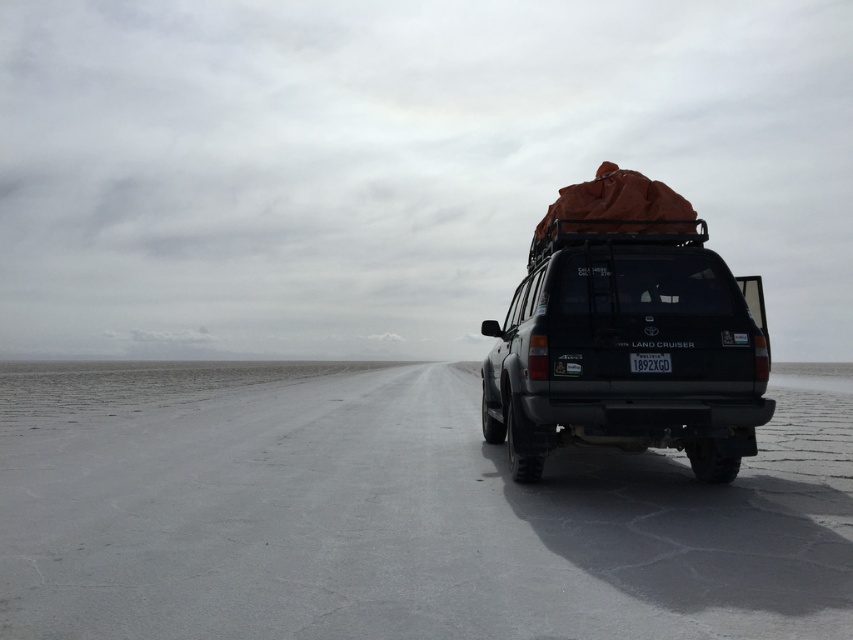
Question: Is matte black suv at center to the left of black plastic license plate at center from the viewer's perspective?

Choices:
 (A) yes
 (B) no

Answer: (A)

Question: Where is matte black suv at center located in relation to black plastic license plate at center in the image?

Choices:
 (A) left
 (B) right

Answer: (A)

Question: Can you confirm if matte black suv at center is bigger than black plastic license plate at center?

Choices:
 (A) no
 (B) yes

Answer: (B)

Question: Among these points, which one is farthest from the camera?

Choices:
 (A) (654, 371)
 (B) (555, 346)

Answer: (B)